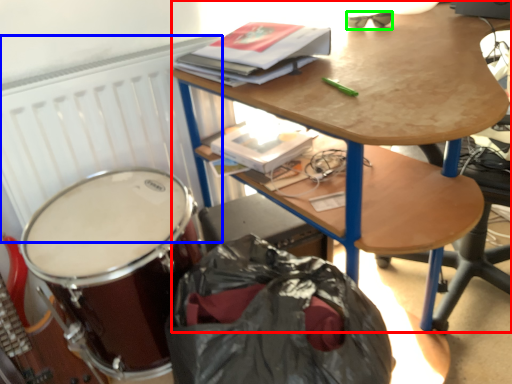
Question: Estimate the real-world distances between objects in this image. Which object is closer to desk (highlighted by a red box), radiator (highlighted by a blue box) or glasses (highlighted by a green box)?

Choices:
 (A) radiator
 (B) glasses

Answer: (A)